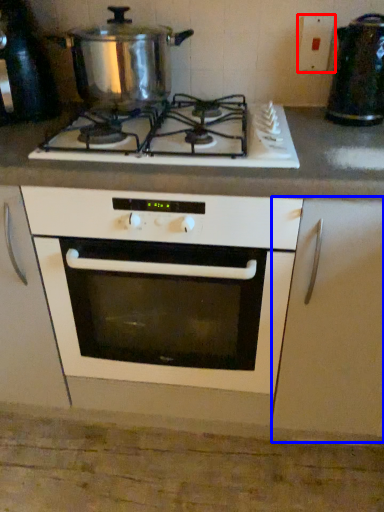
Question: Among these objects, which one is nearest to the camera, electric outlet (highlighted by a red box) or cabinetry (highlighted by a blue box)?

Choices:
 (A) electric outlet
 (B) cabinetry

Answer: (B)